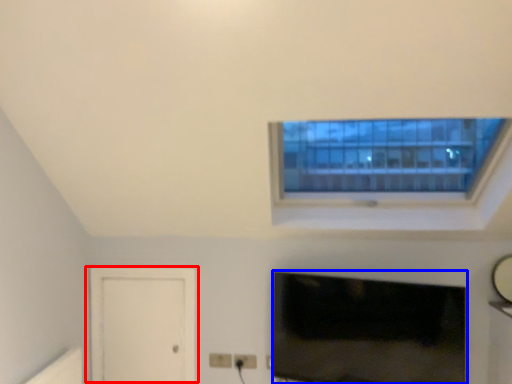
Question: Among these objects, which one is nearest to the camera, door (highlighted by a red box) or television (highlighted by a blue box)?

Choices:
 (A) door
 (B) television

Answer: (B)